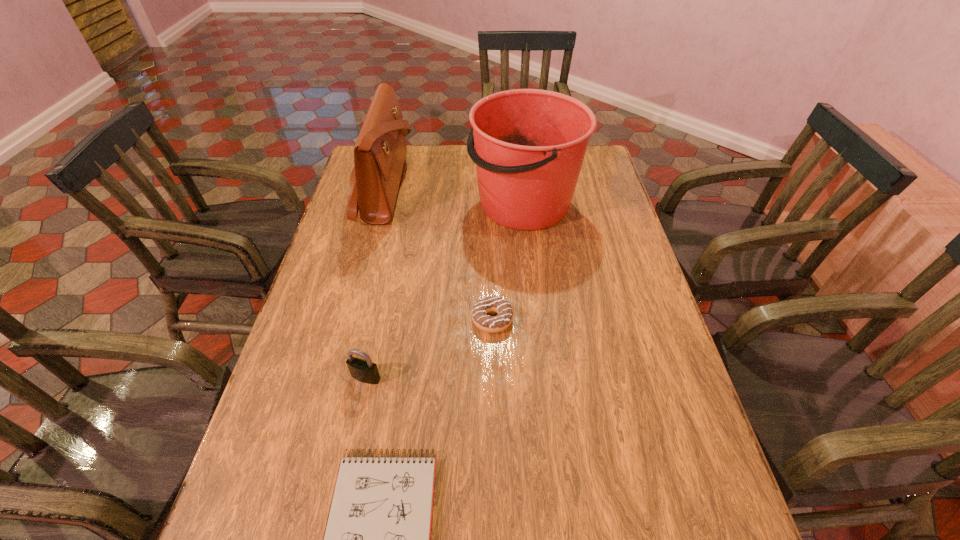
This screenshot has width=960, height=540. What are the coordinates of `satchel` in the screenshot? It's located at (379, 154).

You are a GUI agent. You are given a task and a screenshot of the screen. Output one action in this format:
    pyautogui.click(x=<x>, y=<y>)
    Task: Click on the bucket
    This screenshot has height=540, width=960.
    Given the screenshot: What is the action you would take?
    pyautogui.click(x=530, y=144)

I want to click on the fourth farthest object, so click(x=365, y=371).

Image resolution: width=960 pixels, height=540 pixels. Identify the location of the third tallest object. (365, 371).

The width and height of the screenshot is (960, 540). Find the location of `the fourth tallest object`. the fourth tallest object is located at coordinates (492, 324).

The image size is (960, 540). I want to click on the third farthest object, so click(492, 324).

In order to click on free location located 0.340m on the front flap of the satchel in this screenshot , I will do `click(507, 187)`.

This screenshot has width=960, height=540. I want to click on vacant region located 0.170m on the left of the bucket, so 418,205.

Locate an element on the screen. The height and width of the screenshot is (540, 960). free space located on the right of the padlock is located at coordinates (462, 377).

Locate an element on the screen. This screenshot has width=960, height=540. vacant space located on the front of the third nearest object is located at coordinates (496, 470).